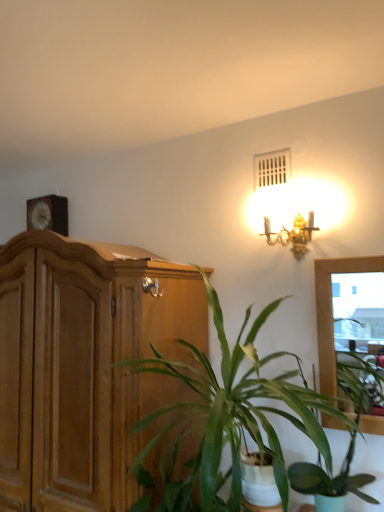
The image size is (384, 512). What do you see at coordinates (292, 234) in the screenshot? I see `gold metallic sconce at upper right` at bounding box center [292, 234].

This screenshot has width=384, height=512. Describe the element at coordinates (48, 214) in the screenshot. I see `wooden clock at upper left` at that location.

Locate an element on the screen. This screenshot has height=512, width=384. green leafy plant at center, the 1th houseplant positioned from the right is located at coordinates (348, 447).

Consider the image. How distant is gold metallic sconce at upper right from green leafy plant at center, marked as the second houseplant in a right-to-left arrangement?

gold metallic sconce at upper right and green leafy plant at center, marked as the second houseplant in a right-to-left arrangement, are 28.00 inches apart.

Is gold metallic sconce at upper right in contact with green leafy plant at center, the 1th houseplant when ordered from left to right?

gold metallic sconce at upper right and green leafy plant at center, the 1th houseplant when ordered from left to right, are clearly separated.

Is point (312, 217) closer or farther from the camera than point (172, 474)?

Clearly, point (312, 217) is more distant from the camera than point (172, 474).

Does green leafy plant at center, marked as the second houseplant in a right-to-left arrangement, have a larger size compared to wooden cabinet at left?

No.

The width and height of the screenshot is (384, 512). What are the coordinates of `cabinetry on the left of the green leafy plant at center, marked as the second houseplant in a right-to-left arrangement` in the screenshot? It's located at (84, 366).

Could wooden cabinet at left be considered to be inside green leafy plant at center, marked as the second houseplant in a right-to-left arrangement?

Definitely not — wooden cabinet at left is not inside green leafy plant at center, marked as the second houseplant in a right-to-left arrangement.

Is green leafy plant at center, the 1th houseplant positioned from the right, shorter than green leafy plant at center, marked as the second houseplant in a right-to-left arrangement?

Correct, green leafy plant at center, the 1th houseplant positioned from the right, is not as tall as green leafy plant at center, marked as the second houseplant in a right-to-left arrangement.

From a real-world perspective, which is physically above, green leafy plant at center, the 1th houseplant positioned from the right, or green leafy plant at center, the 1th houseplant when ordered from left to right?

In real-world perspective, green leafy plant at center, the 1th houseplant when ordered from left to right, is above.

At what (x,y) coordinates should I click in order to perform the action: click on houseplant that is on the left side of green leafy plant at center, the 1th houseplant positioned from the right. Please return your answer as a coordinate pair (x, y). Looking at the image, I should click on (228, 417).

Looking at this image, from the image's perspective, is green leafy plant at center, the 1th houseplant positioned from the right, below green leafy plant at center, the 1th houseplant when ordered from left to right?

Yes, from the image's perspective, green leafy plant at center, the 1th houseplant positioned from the right, is beneath green leafy plant at center, the 1th houseplant when ordered from left to right.

Is gold metallic sconce at upper right in front of or behind wooden clock at upper left in the image?

Visually, gold metallic sconce at upper right is located in front of wooden clock at upper left.

Is gold metallic sconce at upper right not near wooden clock at upper left?

Indeed, gold metallic sconce at upper right is not near wooden clock at upper left.

Which of these two, gold metallic sconce at upper right or wooden clock at upper left, is smaller?

Smaller between the two is wooden clock at upper left.

Between gold metallic sconce at upper right and wooden clock at upper left, which one has smaller width?

wooden clock at upper left is thinner.

Is wooden cabinet at left inside gold metallic sconce at upper right?

Actually, wooden cabinet at left is outside gold metallic sconce at upper right.

What's the angular difference between gold metallic sconce at upper right and wooden cabinet at left's facing directions?

The facing directions of gold metallic sconce at upper right and wooden cabinet at left are 5.89 degrees apart.

Is gold metallic sconce at upper right facing towards wooden cabinet at left?

No, gold metallic sconce at upper right is not turned towards wooden cabinet at left.

Does point (290, 237) lie behind point (42, 319)?

Yes.

Which is behind, point (335, 479) or point (346, 467)?

The point (335, 479) is more distant.

Based on their positions, is green leafy plant at center, marked as the second houseplant in a right-to-left arrangement, located to the left or right of green leafy plant at center, marked as the second houseplant in a left-to-right arrangement?

Based on their positions, green leafy plant at center, marked as the second houseplant in a right-to-left arrangement, is located to the left of green leafy plant at center, marked as the second houseplant in a left-to-right arrangement.

Can you tell me how much green leafy plant at center, marked as the second houseplant in a right-to-left arrangement, and green leafy plant at center, marked as the second houseplant in a left-to-right arrangement, differ in facing direction?

The angular difference between green leafy plant at center, marked as the second houseplant in a right-to-left arrangement, and green leafy plant at center, marked as the second houseplant in a left-to-right arrangement, is 4.49 degrees.

Who is more distant, green leafy plant at center, the 1th houseplant when ordered from left to right, or green leafy plant at center, marked as the second houseplant in a left-to-right arrangement?

green leafy plant at center, marked as the second houseplant in a left-to-right arrangement, is behind.

Is wooden cabinet at left aimed at green leafy plant at center, the 1th houseplant when ordered from left to right?

No, wooden cabinet at left is not facing towards green leafy plant at center, the 1th houseplant when ordered from left to right.

Based on their sizes in the image, would you say wooden cabinet at left is bigger or smaller than green leafy plant at center, the 1th houseplant when ordered from left to right?

Considering their sizes, wooden cabinet at left takes up more space than green leafy plant at center, the 1th houseplant when ordered from left to right.

Consider the image. Is wooden cabinet at left wider than green leafy plant at center, the 1th houseplant when ordered from left to right?

In fact, wooden cabinet at left might be narrower than green leafy plant at center, the 1th houseplant when ordered from left to right.

There is a gold metallic sconce at upper right. Where is `the 1st houseplant below it (from a real-world perspective)`? the 1st houseplant below it (from a real-world perspective) is located at coordinates (228, 417).

You are a GUI agent. You are given a task and a screenshot of the screen. Output one action in this format:
    pyautogui.click(x=<x>, y=<y>)
    Task: Click on the cabinetry on the left of green leafy plant at center, marked as the second houseplant in a right-to-left arrangement
    The height and width of the screenshot is (512, 384).
    Given the screenshot: What is the action you would take?
    pyautogui.click(x=84, y=366)

Based on their spatial positions, is gold metallic sconce at upper right or green leafy plant at center, marked as the second houseplant in a left-to-right arrangement, further from wooden clock at upper left?

The object further to wooden clock at upper left is green leafy plant at center, marked as the second houseplant in a left-to-right arrangement.

Considering their positions, is green leafy plant at center, the 1th houseplant positioned from the right, positioned closer to wooden cabinet at left than green leafy plant at center, the 1th houseplant when ordered from left to right?

green leafy plant at center, the 1th houseplant when ordered from left to right, lies closer to wooden cabinet at left than the other object.

When comparing their distances from green leafy plant at center, marked as the second houseplant in a left-to-right arrangement, does gold metallic sconce at upper right or wooden clock at upper left seem closer?

gold metallic sconce at upper right.

When comparing their distances from wooden cabinet at left, does green leafy plant at center, the 1th houseplant when ordered from left to right, or green leafy plant at center, marked as the second houseplant in a left-to-right arrangement, seem further?

Among the two, green leafy plant at center, marked as the second houseplant in a left-to-right arrangement, is located further to wooden cabinet at left.

Considering their positions, is wooden cabinet at left positioned further to wooden clock at upper left than green leafy plant at center, marked as the second houseplant in a left-to-right arrangement?

The object further to wooden clock at upper left is green leafy plant at center, marked as the second houseplant in a left-to-right arrangement.

From the image, which object appears to be nearer to green leafy plant at center, the 1th houseplant positioned from the right, gold metallic sconce at upper right or wooden cabinet at left?

gold metallic sconce at upper right is closer to green leafy plant at center, the 1th houseplant positioned from the right.

Based on their spatial positions, is green leafy plant at center, marked as the second houseplant in a left-to-right arrangement, or gold metallic sconce at upper right further from wooden cabinet at left?

The object further to wooden cabinet at left is green leafy plant at center, marked as the second houseplant in a left-to-right arrangement.

When comparing their distances from green leafy plant at center, marked as the second houseplant in a left-to-right arrangement, does wooden cabinet at left or wooden clock at upper left seem further?

wooden clock at upper left.

At what (x,y) coordinates should I click in order to perform the action: click on houseplant located between wooden cabinet at left and gold metallic sconce at upper right in the left-right direction. Please return your answer as a coordinate pair (x, y). The height and width of the screenshot is (512, 384). Looking at the image, I should click on (228, 417).

Where is `houseplant between gold metallic sconce at upper right and green leafy plant at center, the 1th houseplant positioned from the right, from top to bottom`? The height and width of the screenshot is (512, 384). houseplant between gold metallic sconce at upper right and green leafy plant at center, the 1th houseplant positioned from the right, from top to bottom is located at coordinates (228, 417).

Where is `cabinetry located between wooden clock at upper left and gold metallic sconce at upper right in the left-right direction`? The height and width of the screenshot is (512, 384). cabinetry located between wooden clock at upper left and gold metallic sconce at upper right in the left-right direction is located at coordinates (84, 366).

Locate an element on the screen. The image size is (384, 512). lamp between wooden cabinet at left and green leafy plant at center, marked as the second houseplant in a left-to-right arrangement, in the horizontal direction is located at coordinates (292, 234).